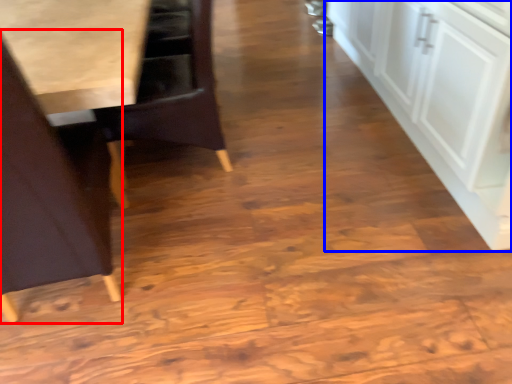
Question: Which object appears farthest to the camera in this image, chair (highlighted by a red box) or cabinetry (highlighted by a blue box)?

Choices:
 (A) chair
 (B) cabinetry

Answer: (B)